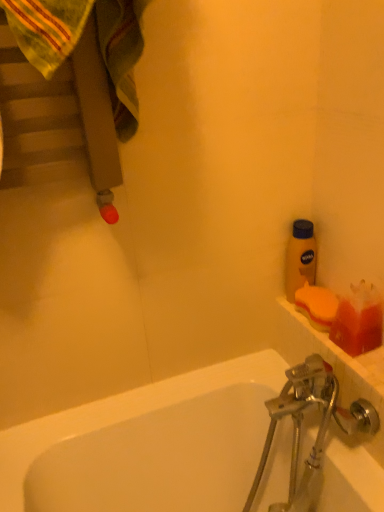
Question: From the image's perspective, does translucent orange soap at right appear lower than orange sponge at right?

Choices:
 (A) yes
 (B) no

Answer: (A)

Question: Does translucent orange soap at right lie in front of orange sponge at right?

Choices:
 (A) no
 (B) yes

Answer: (B)

Question: Is translucent orange soap at right next to orange sponge at right and touching it?

Choices:
 (A) no
 (B) yes

Answer: (B)

Question: Is translucent orange soap at right oriented towards orange sponge at right?

Choices:
 (A) no
 (B) yes

Answer: (A)

Question: From a real-world perspective, is translucent orange soap at right located higher than orange sponge at right?

Choices:
 (A) yes
 (B) no

Answer: (A)

Question: In terms of width, does translucent orange soap at right look wider or thinner when compared to orange sponge at right?

Choices:
 (A) wide
 (B) thin

Answer: (B)

Question: In the image, is translucent orange soap at right positioned in front of or behind orange sponge at right?

Choices:
 (A) front
 (B) behind

Answer: (A)

Question: Is translucent orange soap at right inside the boundaries of orange sponge at right, or outside?

Choices:
 (A) outside
 (B) inside

Answer: (A)

Question: Visually, is translucent orange soap at right positioned to the left or to the right of orange sponge at right?

Choices:
 (A) right
 (B) left

Answer: (A)

Question: Looking at their shapes, would you say translucent orange soap at right is wider or thinner than yellow matte bottle at upper right?

Choices:
 (A) wide
 (B) thin

Answer: (A)

Question: Would you say translucent orange soap at right is to the left or to the right of yellow matte bottle at upper right in the picture?

Choices:
 (A) left
 (B) right

Answer: (B)

Question: From a real-world perspective, relative to yellow matte bottle at upper right, is translucent orange soap at right vertically above or below?

Choices:
 (A) above
 (B) below

Answer: (B)

Question: Is translucent orange soap at right spatially inside yellow matte bottle at upper right, or outside of it?

Choices:
 (A) inside
 (B) outside

Answer: (B)

Question: From the image's perspective, is orange sponge at right positioned above or below yellow matte bottle at upper right?

Choices:
 (A) above
 (B) below

Answer: (B)

Question: Is orange sponge at right taller or shorter than yellow matte bottle at upper right?

Choices:
 (A) short
 (B) tall

Answer: (A)